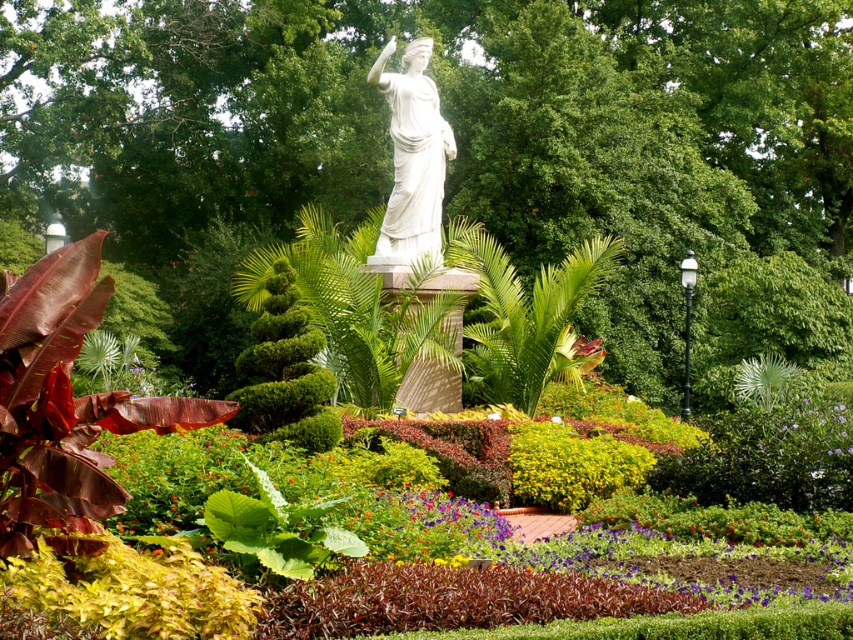
You are a GUI agent. You are given a task and a screenshot of the screen. Output one action in this format:
    pyautogui.click(x=<x>, y=<y>)
    Task: Click on the green textured bush at center
    
    Given the screenshot: What is the action you would take?
    pyautogui.click(x=285, y=372)

Who is positioned more to the left, green textured bush at center or white marble statue at center?

From the viewer's perspective, green textured bush at center appears more on the left side.

Where is `green textured bush at center`? The image size is (853, 640). green textured bush at center is located at coordinates (285, 372).

Between green leafy tree at center and green textured bush at center, which one has less height?

With less height is green textured bush at center.

Is green leafy tree at center above green textured bush at center?

Indeed, green leafy tree at center is positioned over green textured bush at center.

Does point (361, 205) come behind point (318, 349)?

Yes.

You are a GUI agent. You are given a task and a screenshot of the screen. Output one action in this format:
    pyautogui.click(x=<x>, y=<y>)
    Task: Click on the green leafy tree at center
    This screenshot has width=853, height=640.
    Given the screenshot: What is the action you would take?
    pyautogui.click(x=456, y=138)

Does green leafy tree at center have a smaller size compared to white marble statue at center?

No, green leafy tree at center is not smaller than white marble statue at center.

Measure the distance between green leafy tree at center and camera.

green leafy tree at center and camera are 27.59 meters apart.

Does point (244, 129) come closer to viewer compared to point (421, 108)?

No, it is behind (421, 108).

I want to click on green leafy tree at center, so click(456, 138).